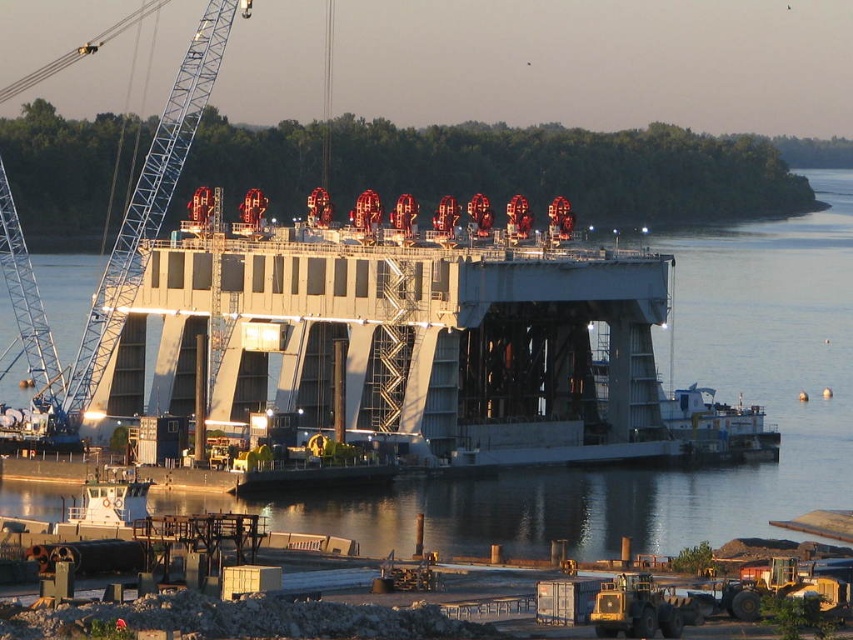
Which is in front, point (734, 289) or point (128, 248)?

Point (128, 248)

Who is positioned more to the left, metallic water at center or blue metallic crane at left?

blue metallic crane at left is more to the left.

The height and width of the screenshot is (640, 853). I want to click on metallic water at center, so click(x=756, y=371).

I want to click on metallic water at center, so click(x=756, y=371).